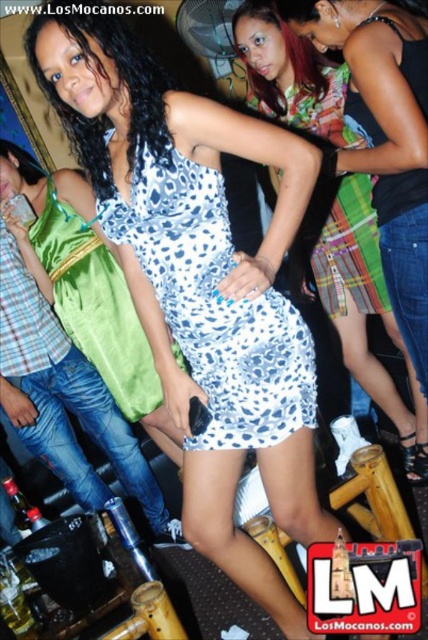
Question: Which is farther from the white leopard print dress at center?

Choices:
 (A) satin green dress at left
 (B) printed fabric dress at center
 (C) blue leopard print dress at center

Answer: (A)

Question: In this image, where is satin green dress at left located relative to printed fabric dress at center?

Choices:
 (A) below
 (B) above

Answer: (A)

Question: Which point is closer to the camera?

Choices:
 (A) (155, 387)
 (B) (282, 104)
 (C) (363, 218)
 (D) (314, 416)

Answer: (D)

Question: Considering the relative positions of white leopard print dress at center and printed fabric dress at center in the image provided, where is white leopard print dress at center located with respect to printed fabric dress at center?

Choices:
 (A) above
 (B) below

Answer: (B)

Question: Can you confirm if blue leopard print dress at center is positioned below white leopard print dress at center?

Choices:
 (A) no
 (B) yes

Answer: (B)

Question: Estimate the real-world distances between objects in this image. Which object is closer to the white leopard print dress at center?

Choices:
 (A) blue leopard print dress at center
 (B) satin green dress at left
 (C) printed fabric dress at center

Answer: (C)